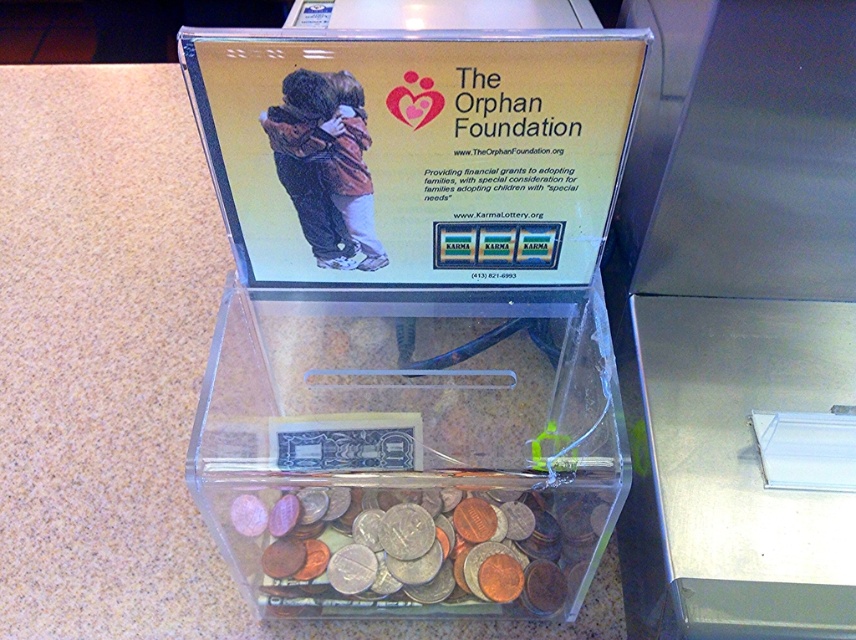
You are organizing a charity event and want to display the transparent plastic box at center and the shiny metallic coins at center. Since the box is wider than the coins, how should you arrange them to ensure the coins are fully visible within the box?

The transparent plastic box at center is wider than the shiny metallic coins at center, so arranging the coins in the center of the box will ensure they are fully visible and properly displayed.

Based on the photo, you are a cashier at a store and need to place a 3.1 inch wide promotional poster between the transparent plastic box at center and the shiny metallic coins at center. Is there enough space between them to fit the poster?

The transparent plastic box at center is 2.94 inches from shiny metallic coins at center. Since the poster is 3.1 inches wide, which is slightly wider than the space between them, the poster cannot fit in the available space.